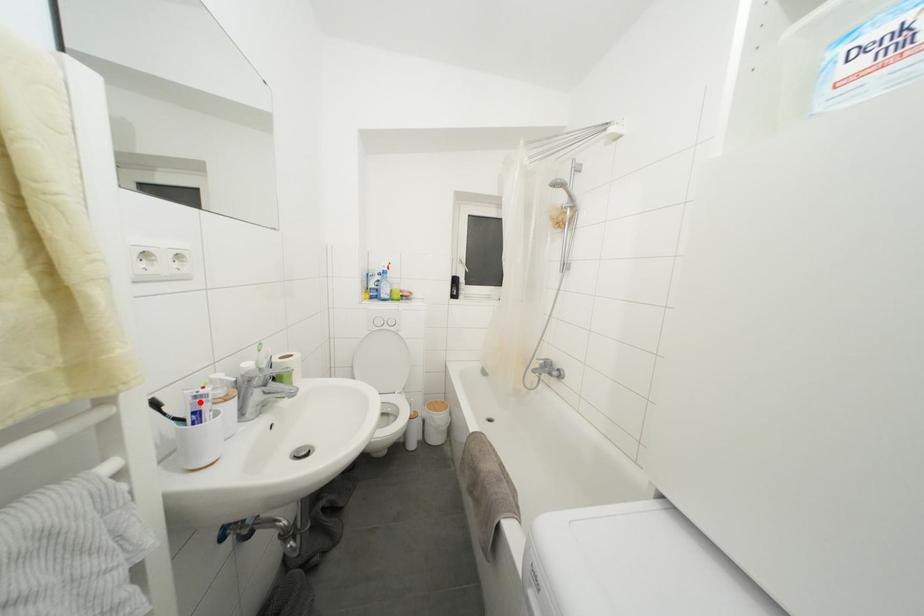
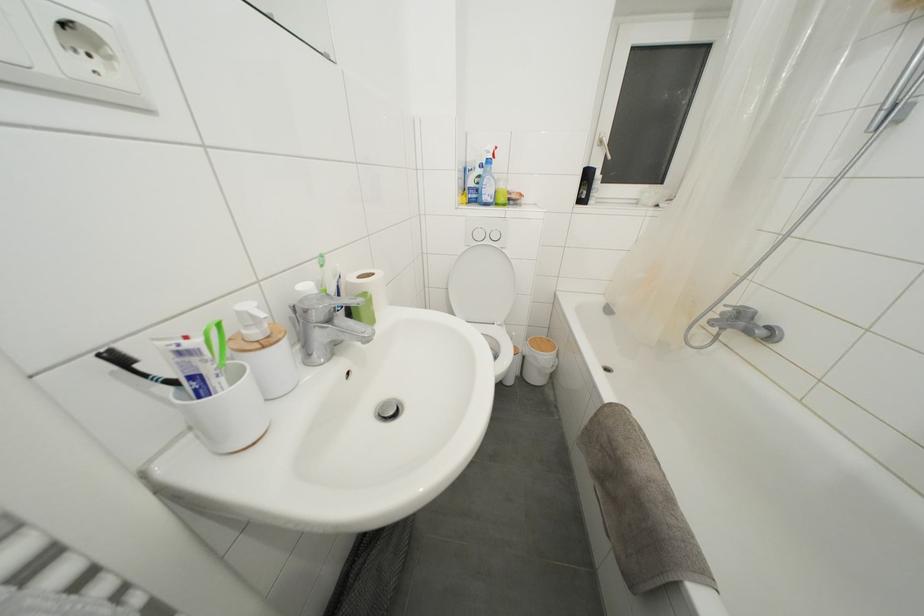
The point at the highlighted location is marked in the first image. Where is the corresponding point in the second image?

(185, 358)